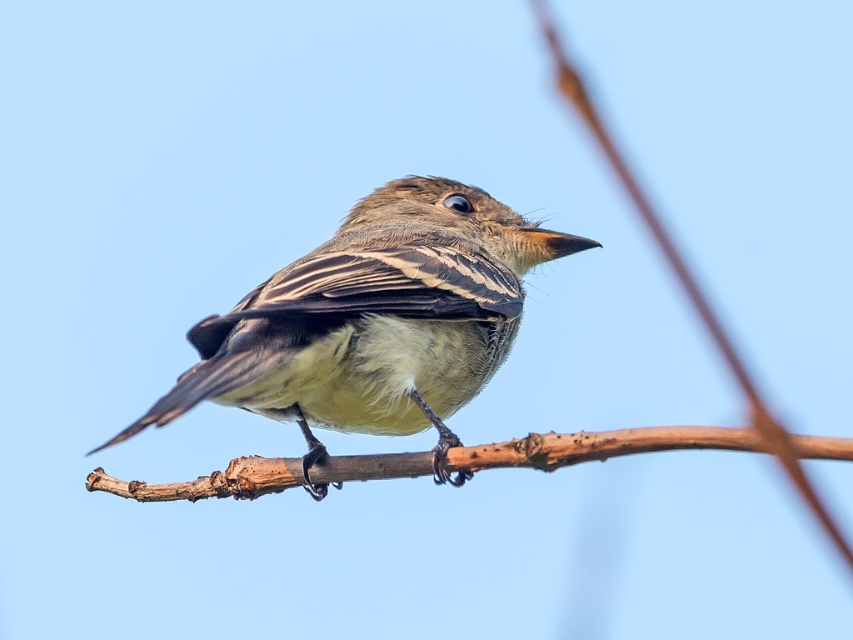
Question: Can you confirm if brown feathered bird at center is wider than brown rough branch at center?

Choices:
 (A) no
 (B) yes

Answer: (A)

Question: Is brown feathered bird at center closer to camera compared to brown rough branch at center?

Choices:
 (A) no
 (B) yes

Answer: (A)

Question: Is brown feathered bird at center thinner than brown rough branch at center?

Choices:
 (A) no
 (B) yes

Answer: (B)

Question: Which of the following is the farthest from the observer?

Choices:
 (A) brown feathered bird at center
 (B) brown rough branch at center

Answer: (A)

Question: Which of the following is the farthest from the observer?

Choices:
 (A) brown rough branch at center
 (B) brown feathered bird at center

Answer: (B)

Question: Which object appears closest to the camera in this image?

Choices:
 (A) brown feathered bird at center
 (B) brown rough branch at center

Answer: (B)